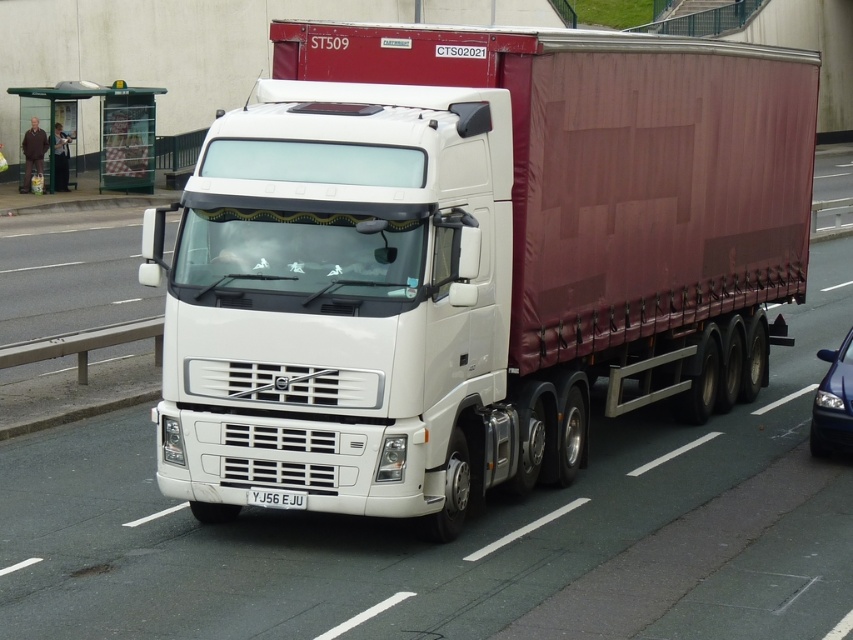
You are a driver in a car and want to overtake the white matte truck at center. The road has two lanes. The glossy blue car at right is in the left lane. Can you safely overtake the truck using the left lane without crossing the solid white line?

The white matte truck at center might be wider than glossy blue car at right, so overtaking might be risky due to the truck possibly occupying more of the left lane. It is safer to avoid overtaking to prevent collision risks.